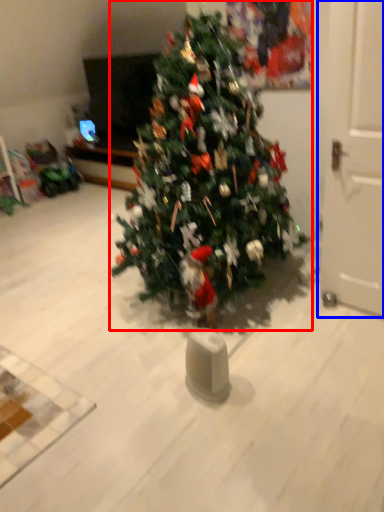
Question: Which point is further to the camera, christmas tree (highlighted by a red box) or door (highlighted by a blue box)?

Choices:
 (A) christmas tree
 (B) door

Answer: (B)